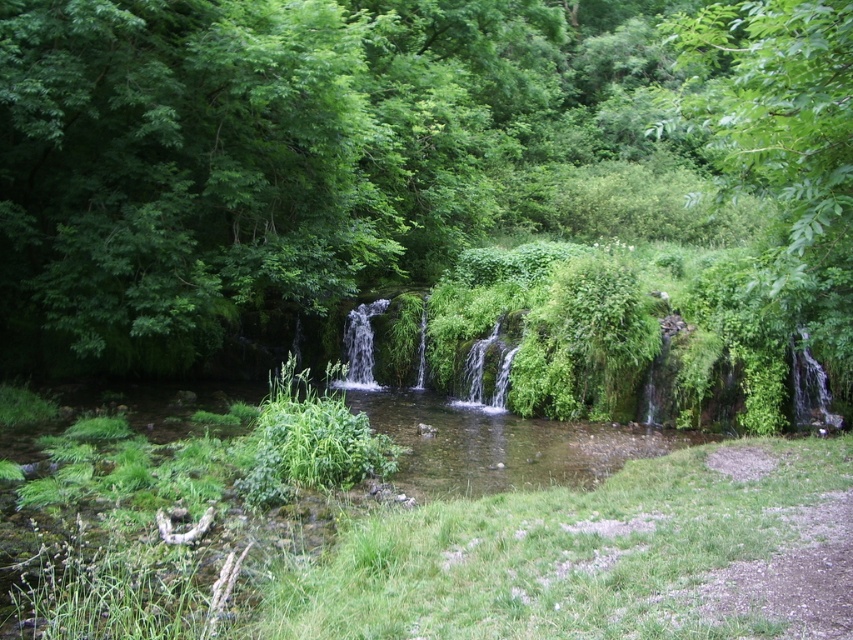
Is the position of green leafy tree at center more distant than that of green leafy tree at upper right?

No, green leafy tree at center is closer to the viewer.

Can you confirm if green leafy tree at center is bigger than green leafy tree at upper right?

Yes, green leafy tree at center is bigger than green leafy tree at upper right.

Does point (798, 209) come behind point (830, 154)?

That is True.

Locate an element on the screen. The width and height of the screenshot is (853, 640). green leafy tree at center is located at coordinates tap(425, 180).